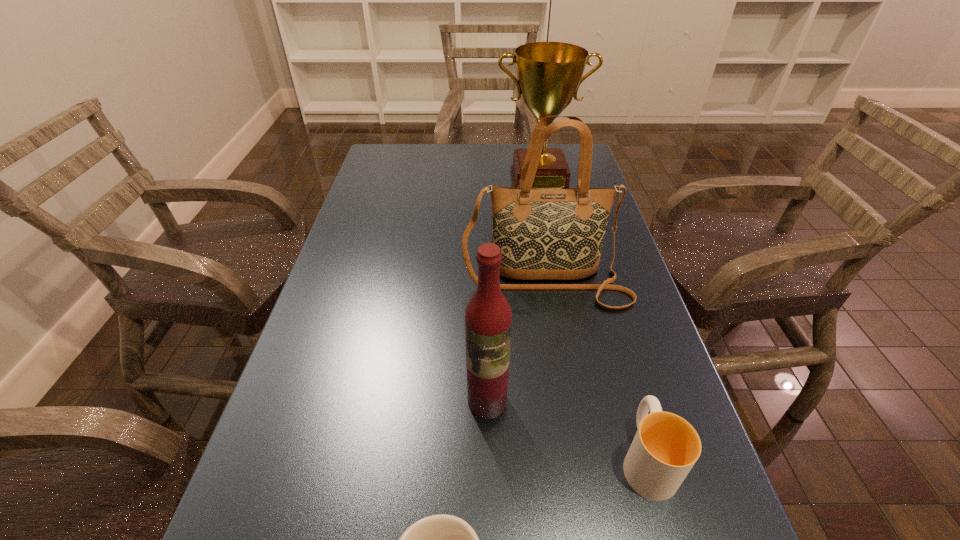
The image size is (960, 540). What are the coordinates of `object located in the far edge section of the desktop` in the screenshot? It's located at (549, 74).

Identify the location of award that is at the right edge. The height and width of the screenshot is (540, 960). (549, 74).

At what (x,y) coordinates should I click in order to perform the action: click on handbag that is at the right edge. Please return your answer as a coordinate pair (x, y). This screenshot has height=540, width=960. Looking at the image, I should click on (543, 233).

At what (x,y) coordinates should I click in order to perform the action: click on cup situated at the right edge. Please return your answer as a coordinate pair (x, y). This screenshot has width=960, height=540. Looking at the image, I should click on (665, 448).

Where is `object that is positioned at the far right corner`? Image resolution: width=960 pixels, height=540 pixels. object that is positioned at the far right corner is located at coordinates (549, 74).

Find the location of `vacant space at the far edge of the desktop`. vacant space at the far edge of the desktop is located at coordinates (507, 148).

Locate an element on the screen. vacant space at the left edge is located at coordinates (358, 206).

Where is `blank space at the right edge of the desktop`? The width and height of the screenshot is (960, 540). blank space at the right edge of the desktop is located at coordinates (690, 503).

Locate an element on the screen. free space at the far right corner of the desktop is located at coordinates (578, 166).

Image resolution: width=960 pixels, height=540 pixels. Identify the location of blank region between the cup and the second farthest object. (596, 370).